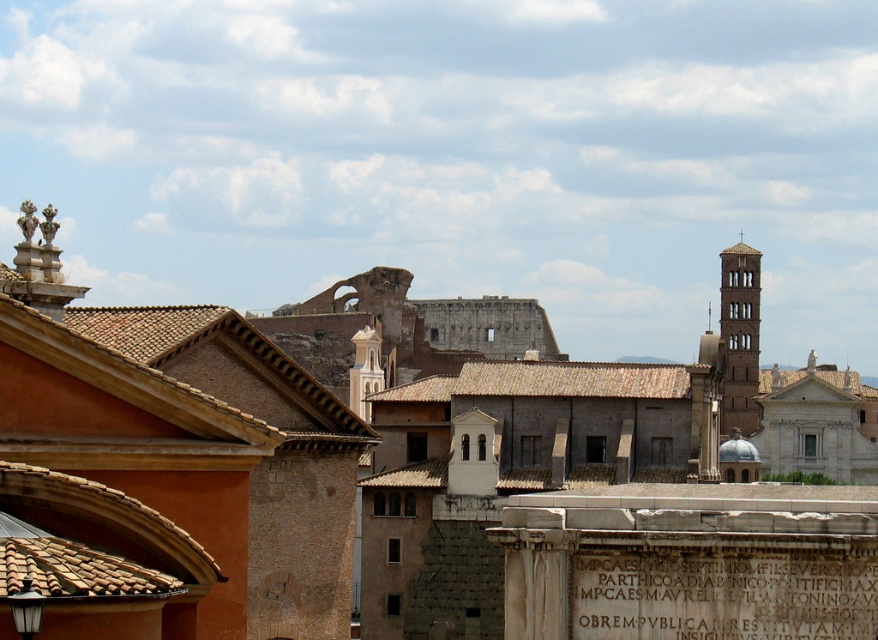
Question: Is the position of brown stone building at center less distant than that of brown stone tower at right?

Choices:
 (A) yes
 (B) no

Answer: (A)

Question: Can you confirm if brown stone building at center is thinner than brown stone tower at right?

Choices:
 (A) no
 (B) yes

Answer: (A)

Question: Is brown stone building at center further to the viewer compared to brown stone tower at right?

Choices:
 (A) no
 (B) yes

Answer: (A)

Question: Which point is closer to the camera?

Choices:
 (A) brown stone building at center
 (B) brown stone tower at right

Answer: (A)